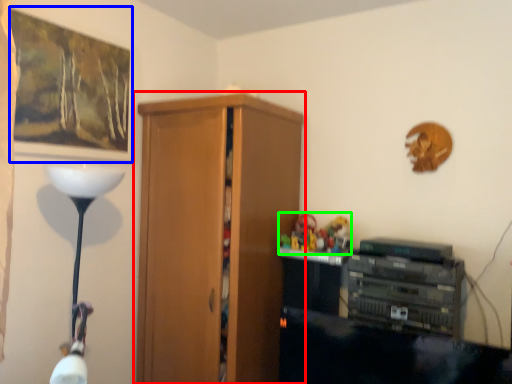
Question: Estimate the real-world distances between objects in this image. Which object is farther from cupboard (highlighted by a red box), picture frame (highlighted by a blue box) or toy (highlighted by a green box)?

Choices:
 (A) picture frame
 (B) toy

Answer: (A)